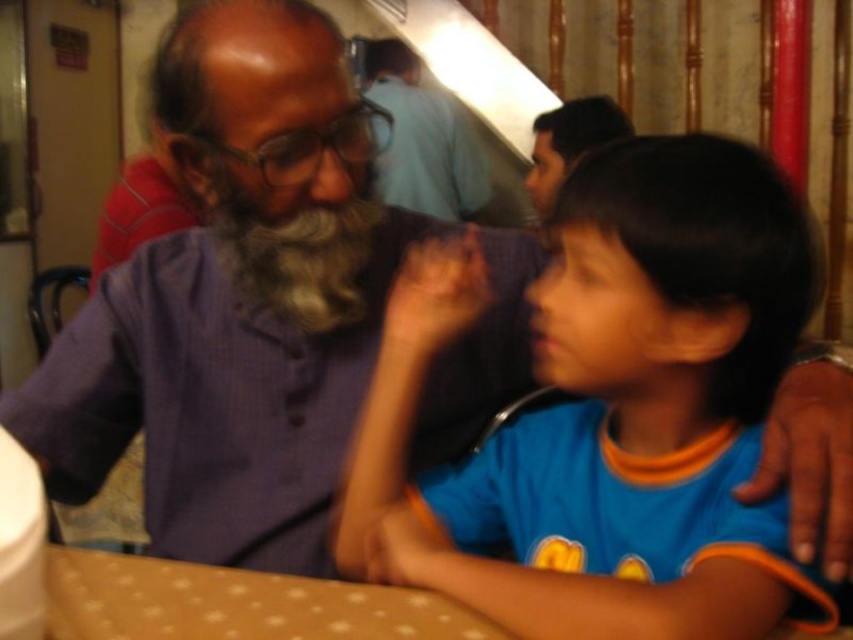
You are a person who is 1.7 meters tall and standing in front of the brown fabric table at lower center. If you want to place your hands on the table, will your hands reach the table?

The brown fabric table at lower center is 57.89 centimeters away from you. Since the average height of a table is around 75 centimeters, and you are 1.7 meters tall, your hands will easily reach the table.